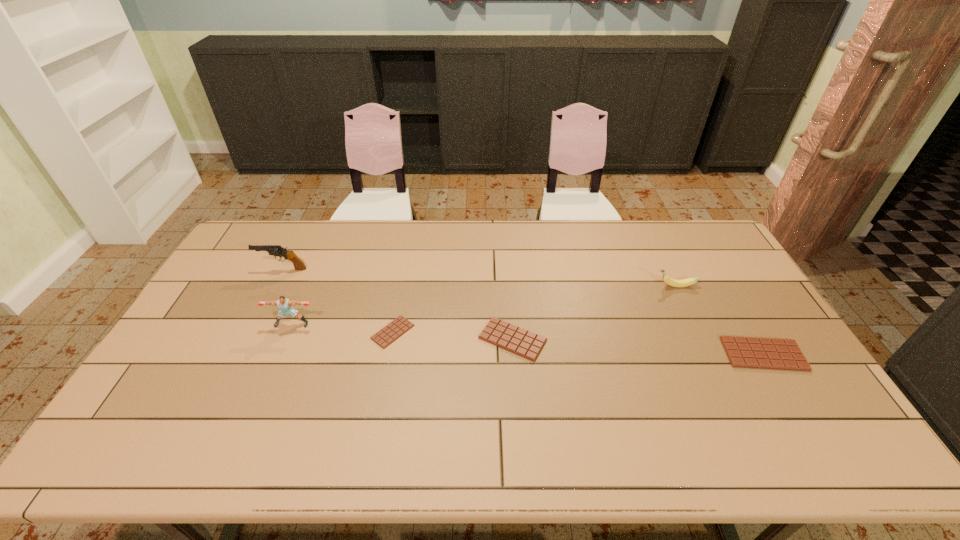
This screenshot has height=540, width=960. I want to click on vacant space located on the right of the second candy bar from left to right, so click(x=605, y=339).

This screenshot has height=540, width=960. What are the coordinates of `vacant space located 0.330m on the back of the rightmost candy bar` in the screenshot? It's located at (710, 265).

This screenshot has height=540, width=960. I want to click on vacant space located 0.220m on the front-facing side of the puncher, so click(264, 391).

Where is `vacant area situated 0.090m along the barrel of the farthest object`? This screenshot has height=540, width=960. vacant area situated 0.090m along the barrel of the farthest object is located at coordinates (232, 269).

Find the location of `vacant point located 0.080m along the barrel of the farthest object`. vacant point located 0.080m along the barrel of the farthest object is located at coordinates (235, 269).

Where is `free space located along the barrel of the farthest object`? This screenshot has height=540, width=960. free space located along the barrel of the farthest object is located at coordinates (241, 269).

At what (x,y) coordinates should I click in order to perform the action: click on blank space located 0.160m at the stem of the third tallest object. Please return your answer as a coordinate pair (x, y). The image size is (960, 540). Looking at the image, I should click on (606, 286).

Identify the location of free space located at the stem of the third tallest object. The width and height of the screenshot is (960, 540). (557, 286).

This screenshot has width=960, height=540. Find the location of `free location located 0.220m at the stem of the third tallest object`. free location located 0.220m at the stem of the third tallest object is located at coordinates (588, 286).

You are a GUI agent. You are given a task and a screenshot of the screen. Output one action in this format:
    pyautogui.click(x=<x>, y=<y>)
    Task: Click on the object situated at the left edge
    The image size is (960, 540).
    Given the screenshot: What is the action you would take?
    pyautogui.click(x=275, y=250)